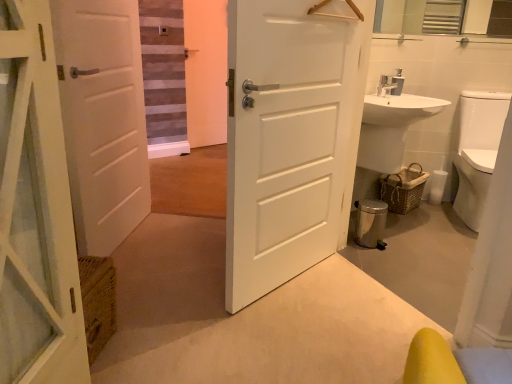
Measure the distance between point (462, 168) and camera.

They are 9.39 feet apart.

The width and height of the screenshot is (512, 384). In order to click on white glossy toilet bowl at right in this screenshot , I will do `click(477, 150)`.

I want to click on white matte door at center, the 2th door in the left-to-right sequence, so click(290, 136).

What is the approximate height of white matte door at center, which is the 1th door in right-to-left order?

4.39 feet.

At what (x,y) coordinates should I click in order to perform the action: click on white glossy toilet bowl at right. Please return your answer as a coordinate pair (x, y). Image resolution: width=512 pixels, height=384 pixels. Looking at the image, I should click on (477, 150).

Could you tell me if white glossy sink at right is facing white matte door at center, which is the 1th door in right-to-left order?

No, white glossy sink at right is not aimed at white matte door at center, which is the 1th door in right-to-left order.

From the image's perspective, is white glossy sink at right beneath white matte door at center, which is the 1th door in right-to-left order?

No, from the image's perspective, white glossy sink at right is not below white matte door at center, which is the 1th door in right-to-left order.

Considering the sizes of objects white glossy sink at right and white matte door at center, the 2th door in the left-to-right sequence, in the image provided, who is taller, white glossy sink at right or white matte door at center, the 2th door in the left-to-right sequence,?

Standing taller between the two is white matte door at center, the 2th door in the left-to-right sequence.

Is the depth of white matte door at left, acting as the first door starting from the left, less than that of white glossy sink at right?

Yes, it is.

Is there a large distance between white matte door at left, placed as the second door when sorted from right to left, and white glossy sink at right?

white matte door at left, placed as the second door when sorted from right to left, is positioned a significant distance from white glossy sink at right.

Between white matte door at left, acting as the first door starting from the left, and white glossy sink at right, which one has larger width?

white glossy sink at right is wider.

Does point (101, 145) appear closer or farther from the camera than point (378, 168)?

Point (101, 145) is positioned closer to the camera compared to point (378, 168).

Is white glossy toilet bowl at right far away from white glossy sink at right?

No, there isn't a large distance between white glossy toilet bowl at right and white glossy sink at right.

Where is `toilet bowl below the white glossy sink at right (from a real-world perspective)`? toilet bowl below the white glossy sink at right (from a real-world perspective) is located at coordinates (477, 150).

Is white glossy toilet bowl at right to the left or to the right of white glossy sink at right in the image?

In the image, white glossy toilet bowl at right appears on the right side of white glossy sink at right.

Is white matte door at left, placed as the second door when sorted from right to left, next to white matte door at center, which is the 1th door in right-to-left order?

No, white matte door at left, placed as the second door when sorted from right to left, is not making contact with white matte door at center, which is the 1th door in right-to-left order.

From the image's perspective, is white matte door at left, acting as the first door starting from the left, located above white matte door at center, the 2th door in the left-to-right sequence?

Yes, from the image's perspective, white matte door at left, acting as the first door starting from the left, is above white matte door at center, the 2th door in the left-to-right sequence.

Is white matte door at left, acting as the first door starting from the left, inside the boundaries of white matte door at center, the 2th door in the left-to-right sequence, or outside?

The correct answer is: outside.

Does point (92, 34) lie in front of point (464, 201)?

Yes.

Does white matte door at left, placed as the second door when sorted from right to left, have a lesser height compared to white glossy toilet bowl at right?

No, white matte door at left, placed as the second door when sorted from right to left, is not shorter than white glossy toilet bowl at right.

Does white matte door at left, placed as the second door when sorted from right to left, appear on the left side of white glossy toilet bowl at right?

Yes, white matte door at left, placed as the second door when sorted from right to left, is to the left of white glossy toilet bowl at right.

From a real-world perspective, between white glossy sink at right and white glossy toilet bowl at right, who is vertically lower?

white glossy toilet bowl at right, from a real-world perspective.

At what (x,y) coordinates should I click in order to perform the action: click on sink above the white glossy toilet bowl at right (from the image's perspective). Please return your answer as a coordinate pair (x, y). This screenshot has height=384, width=512. Looking at the image, I should click on (391, 126).

Does white glossy sink at right have a greater width compared to white glossy toilet bowl at right?

Incorrect, the width of white glossy sink at right does not surpass that of white glossy toilet bowl at right.

From a real-world perspective, which is physically below, white matte door at center, which is the 1th door in right-to-left order, or woven brown basket at lower right?

woven brown basket at lower right.

From the image's perspective, between white matte door at center, the 2th door in the left-to-right sequence, and woven brown basket at lower right, which one is located above?

From the image's view, white matte door at center, the 2th door in the left-to-right sequence, is above.

Is white matte door at center, which is the 1th door in right-to-left order, next to woven brown basket at lower right?

No, white matte door at center, which is the 1th door in right-to-left order, is not in contact with woven brown basket at lower right.

Based on their positions, is white matte door at center, which is the 1th door in right-to-left order, located to the left or right of woven brown basket at lower right?

Clearly, white matte door at center, which is the 1th door in right-to-left order, is on the left of woven brown basket at lower right in the image.

Locate an element on the screen. the 2nd door in front of the white glossy sink at right is located at coordinates (290, 136).

This screenshot has width=512, height=384. I want to click on sink lying above the white matte door at left, acting as the first door starting from the left (from the image's perspective), so click(391, 126).

Which object lies further to the anchor point white glossy toilet bowl at right, white matte door at left, placed as the second door when sorted from right to left, or white matte door at center, the 2th door in the left-to-right sequence?

white matte door at left, placed as the second door when sorted from right to left, lies further to white glossy toilet bowl at right than the other object.

Which object lies nearer to the anchor point white glossy toilet bowl at right, white glossy sink at right or white matte door at center, which is the 1th door in right-to-left order?

Among the two, white glossy sink at right is located nearer to white glossy toilet bowl at right.

Based on their spatial positions, is white glossy sink at right or white glossy toilet bowl at right closer to woven brown basket at lower right?

white glossy sink at right.

Which object lies nearer to the anchor point woven brown basket at lower right, white glossy sink at right or white matte door at center, which is the 1th door in right-to-left order?

white glossy sink at right is positioned closer to the anchor woven brown basket at lower right.

Consider the image. Based on their spatial positions, is white glossy toilet bowl at right or woven brown basket at lower right closer to white glossy sink at right?

woven brown basket at lower right.

Considering their positions, is white matte door at left, acting as the first door starting from the left, positioned further to white matte door at center, which is the 1th door in right-to-left order, than woven brown basket at lower right?

woven brown basket at lower right is further to white matte door at center, which is the 1th door in right-to-left order.

Which object lies further to the anchor point white glossy toilet bowl at right, white matte door at center, which is the 1th door in right-to-left order, or white glossy sink at right?

white matte door at center, which is the 1th door in right-to-left order, lies further to white glossy toilet bowl at right than the other object.

Which object lies nearer to the anchor point white glossy toilet bowl at right, white glossy sink at right or woven brown basket at lower right?

Based on the image, woven brown basket at lower right appears to be nearer to white glossy toilet bowl at right.

Image resolution: width=512 pixels, height=384 pixels. In order to click on sink between white matte door at left, placed as the second door when sorted from right to left, and white glossy toilet bowl at right from left to right in this screenshot , I will do `click(391, 126)`.

The image size is (512, 384). I want to click on basket located between white glossy sink at right and white glossy toilet bowl at right in the left-right direction, so click(x=403, y=189).

The width and height of the screenshot is (512, 384). I want to click on sink between white matte door at center, which is the 1th door in right-to-left order, and woven brown basket at lower right in the front-back direction, so click(x=391, y=126).

This screenshot has width=512, height=384. I want to click on door between white matte door at left, acting as the first door starting from the left, and woven brown basket at lower right, in the horizontal direction, so click(x=290, y=136).